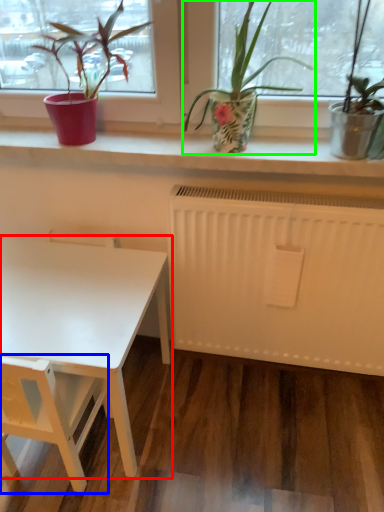
Question: Based on their relative distances, which object is farther from table (highlighted by a red box)? Choose from armchair (highlighted by a blue box) and houseplant (highlighted by a green box).

Choices:
 (A) armchair
 (B) houseplant

Answer: (B)